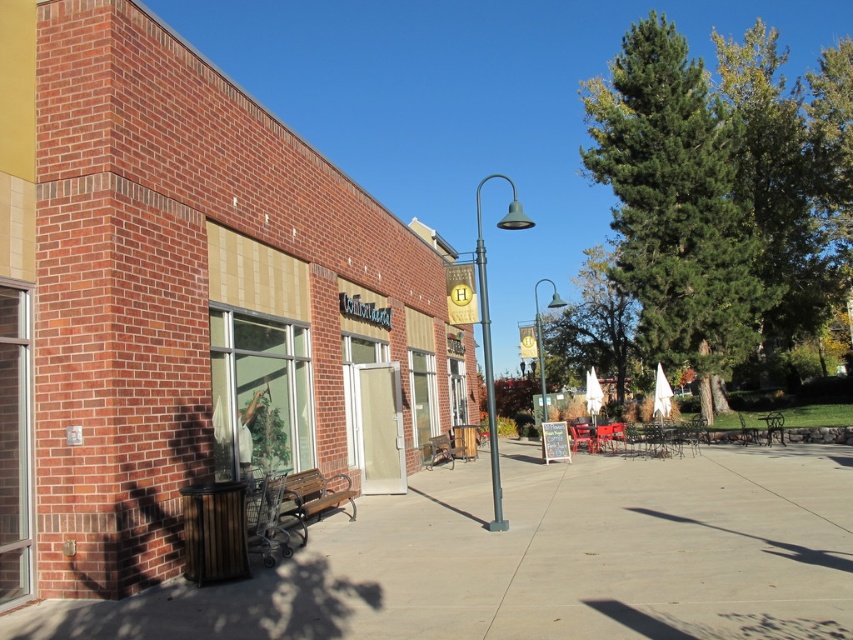
At what (x,y) coordinates should I click in order to perform the action: click on brick building at center. Please return your answer as a coordinate pair (x, y). Looking at the image, I should click on (184, 301).

Which is in front, point (97, 493) or point (636, 224)?

Positioned in front is point (97, 493).

Image resolution: width=853 pixels, height=640 pixels. Identify the location of brick building at center. (184, 301).

Does brown wooden bench at lower left come behind wooden park bench at center?

That is False.

Between brown wooden bench at lower left and wooden park bench at center, which one is positioned lower?

wooden park bench at center is lower down.

Which is in front, point (332, 492) or point (448, 452)?

Positioned in front is point (332, 492).

Find the location of a particular element. brown wooden bench at lower left is located at coordinates (314, 497).

Looking at this image, does smooth concrete pavement at center appear over green leafy tree at upper right?

No, smooth concrete pavement at center is not above green leafy tree at upper right.

What do you see at coordinates (538, 557) in the screenshot? I see `smooth concrete pavement at center` at bounding box center [538, 557].

The height and width of the screenshot is (640, 853). Identify the location of smooth concrete pavement at center. (538, 557).

This screenshot has width=853, height=640. I want to click on smooth concrete pavement at center, so click(538, 557).